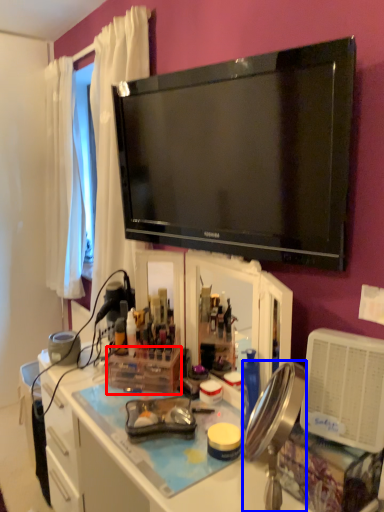
Question: Which object is further to the camera taking this photo, box (highlighted by a red box) or mirror (highlighted by a blue box)?

Choices:
 (A) box
 (B) mirror

Answer: (A)